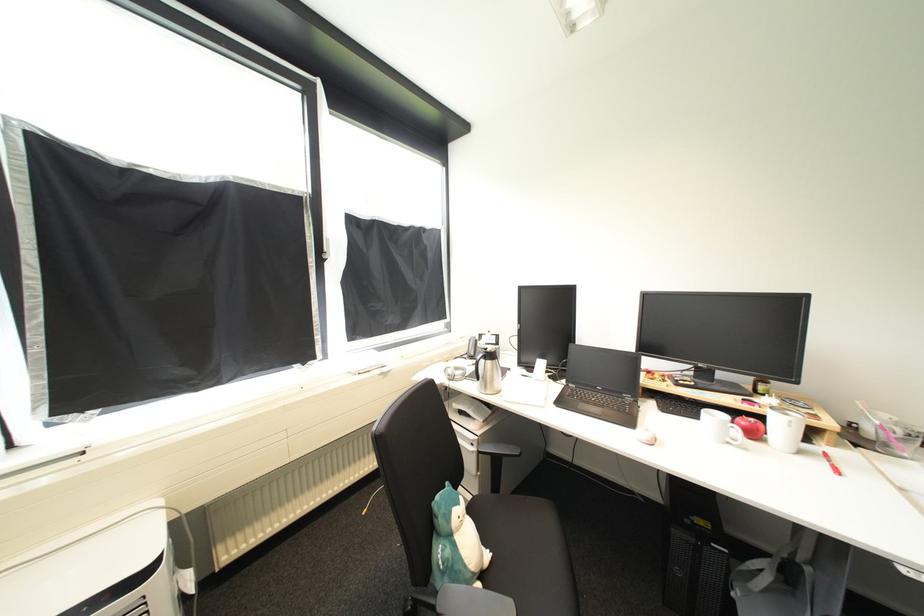
What are the coordinates of `white mug handle` in the screenshot? It's located at (737, 435).